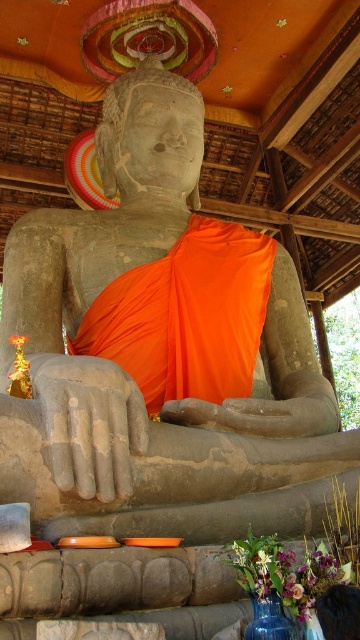
Which of these two, orange silk robe at center or smooth dark wood frame at lower right, stands taller?

orange silk robe at center

Can you confirm if orange silk robe at center is thinner than smooth dark wood frame at lower right?

No, orange silk robe at center is not thinner than smooth dark wood frame at lower right.

Is point (109, 298) in front of point (353, 634)?

No, it is not.

Where is `orange silk robe at center`? This screenshot has height=640, width=360. orange silk robe at center is located at coordinates (186, 316).